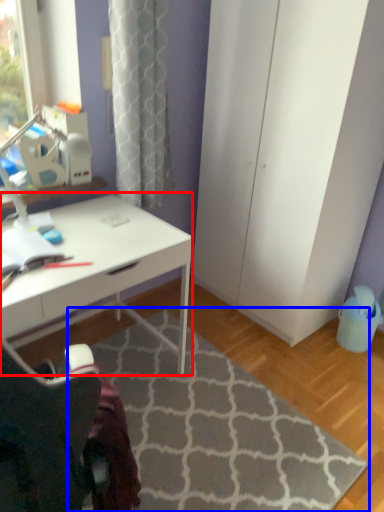
Question: Which point is further to the camera, desk (highlighted by a red box) or doormat (highlighted by a blue box)?

Choices:
 (A) desk
 (B) doormat

Answer: (A)